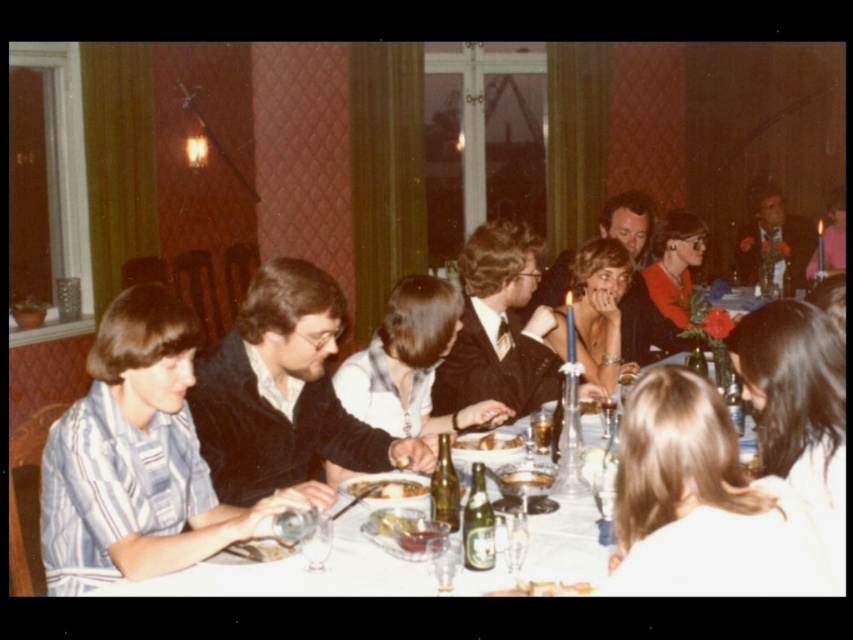
Question: Which of the following is the closest to the observer?

Choices:
 (A) (834, 208)
 (B) (767, 272)

Answer: (B)

Question: Which object appears closest to the camera in this image?

Choices:
 (A) velvet black sweater at center
 (B) smooth white plate at center
 (C) white glossy table at center
 (D) shiny black suit at upper right

Answer: (C)

Question: Can you confirm if white glossy table at center is bigger than shiny black suit at upper right?

Choices:
 (A) yes
 (B) no

Answer: (B)

Question: Which point is closer to the camera?

Choices:
 (A) (485, 442)
 (B) (416, 515)
 (C) (817, 262)
 (D) (598, 348)

Answer: (B)

Question: Can you confirm if smooth brown bread at table center is bigger than shiny silver plate at center?

Choices:
 (A) yes
 (B) no

Answer: (B)

Question: Can you confirm if velvet black sweater at center is positioned above white glossy table at center?

Choices:
 (A) yes
 (B) no

Answer: (A)